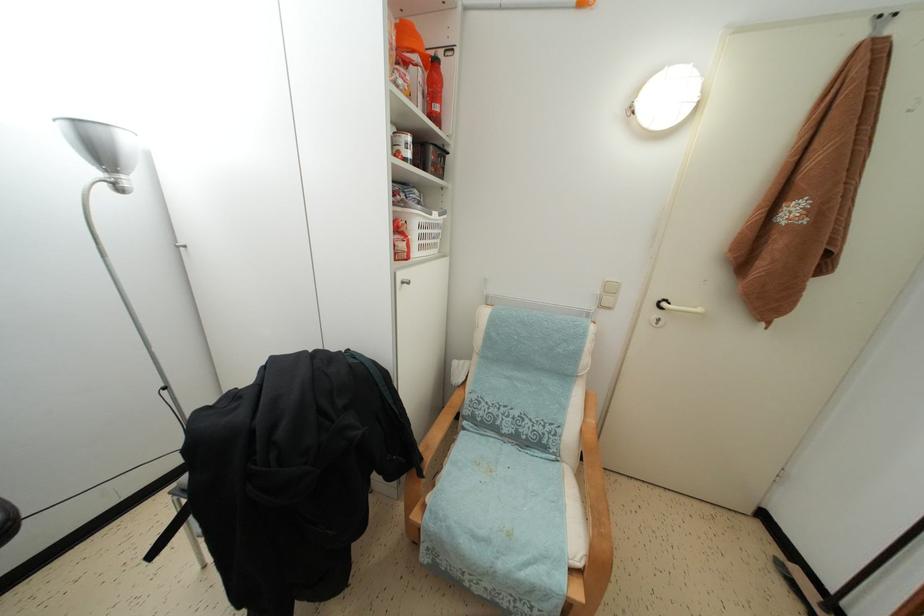
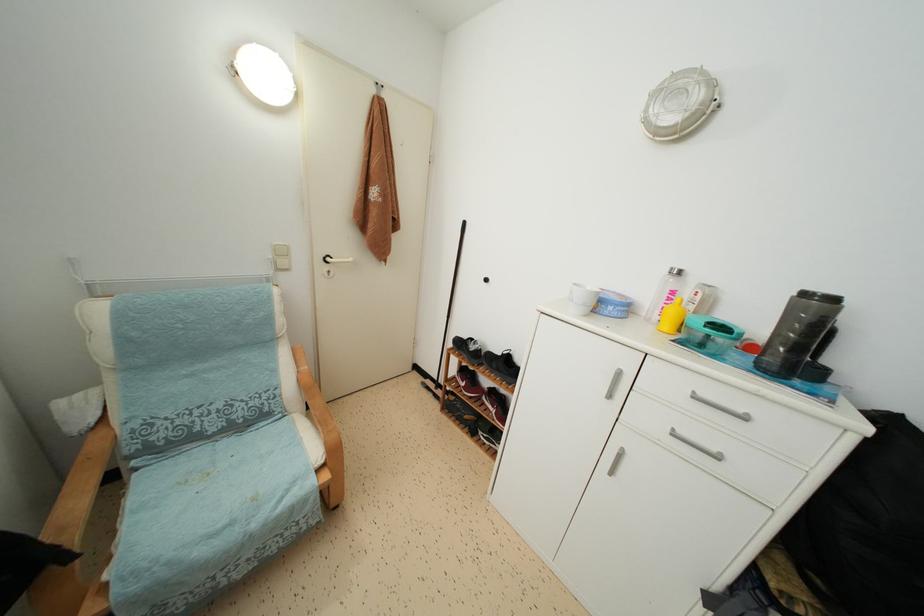
In the second image, find the point that corresponds to [663,308] in the first image.

(329, 264)